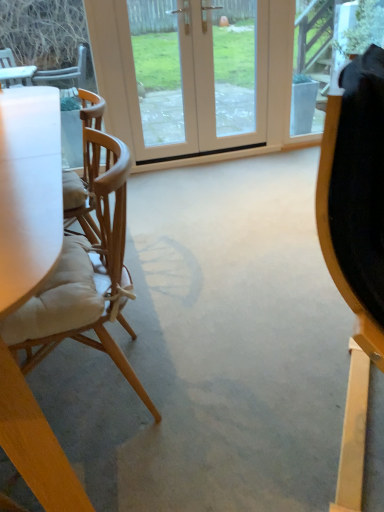
Question: Relative to light beige fabric chair at left, is white glossy door at center in front or behind?

Choices:
 (A) front
 (B) behind

Answer: (B)

Question: Is white glossy door at center to the left or to the right of light beige fabric chair at left in the image?

Choices:
 (A) right
 (B) left

Answer: (A)

Question: Would you say white glossy door at center is inside or outside light beige fabric chair at left?

Choices:
 (A) outside
 (B) inside

Answer: (A)

Question: Considering their positions, is light beige fabric chair at left located in front of or behind white glossy door at center?

Choices:
 (A) front
 (B) behind

Answer: (A)

Question: Looking at the image, does light beige fabric chair at left seem bigger or smaller compared to white glossy door at center?

Choices:
 (A) big
 (B) small

Answer: (A)

Question: In terms of height, does light beige fabric chair at left look taller or shorter compared to white glossy door at center?

Choices:
 (A) tall
 (B) short

Answer: (B)

Question: Visually, is light beige fabric chair at left positioned to the left or to the right of white glossy door at center?

Choices:
 (A) left
 (B) right

Answer: (A)